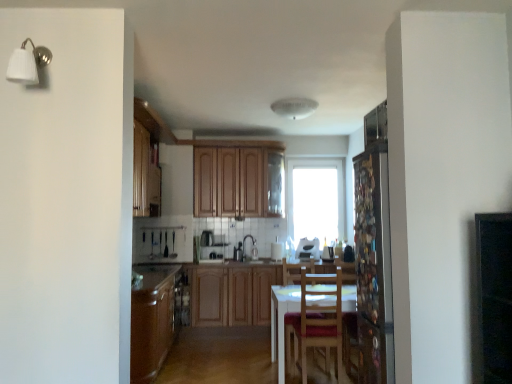
What is the approximate height of white glossy sink at center?

The height of white glossy sink at center is 15.91 inches.

The height and width of the screenshot is (384, 512). Find the location of `wooden cabinets at center, the second cabinetry positioned from the top`. wooden cabinets at center, the second cabinetry positioned from the top is located at coordinates point(232,293).

The height and width of the screenshot is (384, 512). What do you see at coordinates (211, 248) in the screenshot?
I see `matte white microwave at center, the second appliance in the right-to-left sequence` at bounding box center [211, 248].

Find the location of `white matte wall sconce at upper left`. white matte wall sconce at upper left is located at coordinates (27, 63).

Where is `white glossy sink at center`? The image size is (512, 384). white glossy sink at center is located at coordinates (248, 251).

Between point (333, 278) and point (203, 249), which one is positioned behind?

Positioned behind is point (203, 249).

Considering the positions of objects wooden chair at center and matte white microwave at center, the second appliance in the right-to-left sequence, in the image provided, who is in front, wooden chair at center or matte white microwave at center, the second appliance in the right-to-left sequence,?

wooden chair at center is closer to the camera.

Which object is thinner, wooden chair at center or matte white microwave at center, which appears as the first appliance when viewed from the left?

Thinner between the two is matte white microwave at center, which appears as the first appliance when viewed from the left.

Can you confirm if wooden chair at center is positioned to the right of matte white microwave at center, which appears as the first appliance when viewed from the left?

Yes, wooden chair at center is to the right of matte white microwave at center, which appears as the first appliance when viewed from the left.

Considering the positions of objects transparent glass window at center and matte white microwave at center, the second appliance in the right-to-left sequence, in the image provided, who is more to the left, transparent glass window at center or matte white microwave at center, the second appliance in the right-to-left sequence,?

From the viewer's perspective, matte white microwave at center, the second appliance in the right-to-left sequence, appears more on the left side.

Is transparent glass window at center positioned beyond the bounds of matte white microwave at center, the second appliance in the right-to-left sequence?

transparent glass window at center is positioned outside matte white microwave at center, the second appliance in the right-to-left sequence.

Are transparent glass window at center and matte white microwave at center, which appears as the first appliance when viewed from the left, located far from each other?

Yes.

From a real-world perspective, is transparent glass window at center on matte white microwave at center, which appears as the first appliance when viewed from the left?

Yes, from a real-world perspective, transparent glass window at center is over matte white microwave at center, which appears as the first appliance when viewed from the left

Does transparent glass screen door at right lie behind wooden chair at center?

No.

From a real-world perspective, who is located higher, transparent glass screen door at right or wooden chair at center?

From a 3D spatial view, transparent glass screen door at right is above.

Does transparent glass screen door at right have a greater width compared to wooden chair at center?

In fact, transparent glass screen door at right might be narrower than wooden chair at center.

There is a white glossy toaster at center, the second appliance when ordered from left to right. Where is `window above it (from a real-world perspective)`? window above it (from a real-world perspective) is located at coordinates (316, 179).

Is transparent glass window at center surrounding white glossy toaster at center, the second appliance when ordered from left to right?

No, white glossy toaster at center, the second appliance when ordered from left to right, is not a part of transparent glass window at center.

Which object is wider, transparent glass window at center or white glossy toaster at center, which is the 1th appliance from right to left?

white glossy toaster at center, which is the 1th appliance from right to left, is wider.

From the image's perspective, is transparent glass window at center above white glossy toaster at center, which is the 1th appliance from right to left?

Yes, from the image's perspective, transparent glass window at center is over white glossy toaster at center, which is the 1th appliance from right to left.

From a real-world perspective, which is physically below, transparent glass window at center or transparent glass screen door at right?

transparent glass screen door at right.

Would you say transparent glass window at center is outside transparent glass screen door at right?

Yes.

Identify the location of screen door below the transparent glass window at center (from a real-world perspective). The width and height of the screenshot is (512, 384). (373, 266).

Is the depth of transparent glass window at center less than that of transparent glass screen door at right?

No, it is not.

Based on the photo, can you confirm if transparent glass screen door at right is bigger than matte white microwave at center, which appears as the first appliance when viewed from the left?

Yes, transparent glass screen door at right is bigger than matte white microwave at center, which appears as the first appliance when viewed from the left.

Is transparent glass screen door at right to the left of matte white microwave at center, which appears as the first appliance when viewed from the left, from the viewer's perspective?

In fact, transparent glass screen door at right is to the right of matte white microwave at center, which appears as the first appliance when viewed from the left.

Are transparent glass screen door at right and matte white microwave at center, which appears as the first appliance when viewed from the left, far apart?

transparent glass screen door at right is far away from matte white microwave at center, which appears as the first appliance when viewed from the left.

Is transparent glass screen door at right oriented away from matte white microwave at center, which appears as the first appliance when viewed from the left?

transparent glass screen door at right is not turned away from matte white microwave at center, which appears as the first appliance when viewed from the left.

From a real-world perspective, who is located higher, matte white microwave at center, the second appliance in the right-to-left sequence, or wooden chair at center?

In real-world perspective, matte white microwave at center, the second appliance in the right-to-left sequence, is above.

Between matte white microwave at center, the second appliance in the right-to-left sequence, and wooden chair at center, which one has larger size?

With larger size is wooden chair at center.

Which of these two, matte white microwave at center, which appears as the first appliance when viewed from the left, or wooden chair at center, is thinner?

Thinner between the two is matte white microwave at center, which appears as the first appliance when viewed from the left.

Is there a large distance between matte white microwave at center, the second appliance in the right-to-left sequence, and wooden chair at center?

Absolutely, matte white microwave at center, the second appliance in the right-to-left sequence, is distant from wooden chair at center.

Locate an element on the screen. chair on the right of matte white microwave at center, the second appliance in the right-to-left sequence is located at coordinates (316, 321).

The image size is (512, 384). What are the coordinates of `the 2nd appliance counting from the left of the transparent glass window at center` in the screenshot? It's located at (211, 248).

Estimate the real-world distances between objects in this image. Which object is further from white glossy sink at center, transparent glass window at center or matte white microwave at center, which appears as the first appliance when viewed from the left?

transparent glass window at center is positioned further to the anchor white glossy sink at center.

Which object lies nearer to the anchor point matte white microwave at center, the second appliance in the right-to-left sequence, matte brown countertop at lower left or white matte wall sconce at upper left?

The object closer to matte white microwave at center, the second appliance in the right-to-left sequence, is matte brown countertop at lower left.

From the image, which object appears to be nearer to wooden cabinets at center, the 1th cabinetry when ordered from top to bottom, transparent glass window at center or wooden cabinets at center, placed as the first cabinetry when sorted from bottom to top?

transparent glass window at center lies closer to wooden cabinets at center, the 1th cabinetry when ordered from top to bottom, than the other object.

Estimate the real-world distances between objects in this image. Which object is further from transparent glass screen door at right, matte white microwave at center, the second appliance in the right-to-left sequence, or white glossy sink at center?

Based on the image, matte white microwave at center, the second appliance in the right-to-left sequence, appears to be further to transparent glass screen door at right.

From the image, which object appears to be nearer to matte white microwave at center, which appears as the first appliance when viewed from the left, wooden chair at center or white glossy toaster at center, which is the 1th appliance from right to left?

white glossy toaster at center, which is the 1th appliance from right to left, is positioned closer to the anchor matte white microwave at center, which appears as the first appliance when viewed from the left.

Estimate the real-world distances between objects in this image. Which object is closer to wooden cabinets at center, the 1th cabinetry when ordered from top to bottom, white glossy toaster at center, the second appliance when ordered from left to right, or white glossy sink at center?

Based on the image, white glossy sink at center appears to be nearer to wooden cabinets at center, the 1th cabinetry when ordered from top to bottom.

From the image, which object appears to be nearer to white matte wall sconce at upper left, wooden cabinets at center, the second cabinetry positioned from the top, or matte brown countertop at lower left?

matte brown countertop at lower left is closer to white matte wall sconce at upper left.

From the image, which object appears to be farther from wooden chair at center, wooden cabinets at center, which is the second cabinetry from bottom to top, or transparent glass screen door at right?

wooden cabinets at center, which is the second cabinetry from bottom to top, is positioned further to the anchor wooden chair at center.

Locate an element on the screen. The height and width of the screenshot is (384, 512). chair positioned between white matte wall sconce at upper left and white glossy toaster at center, which is the 1th appliance from right to left, from near to far is located at coordinates (x=316, y=321).

This screenshot has width=512, height=384. What are the coordinates of `cabinetry positioned between wooden chair at center and white glossy sink at center from near to far` in the screenshot? It's located at (232, 293).

At what (x,y) coordinates should I click in order to perform the action: click on chair between transparent glass screen door at right and wooden cabinets at center, which is the second cabinetry from bottom to top, from front to back. Please return your answer as a coordinate pair (x, y). Looking at the image, I should click on (316, 321).

I want to click on sink located between white matte wall sconce at upper left and wooden cabinets at center, the 1th cabinetry when ordered from top to bottom, in the depth direction, so click(x=248, y=251).